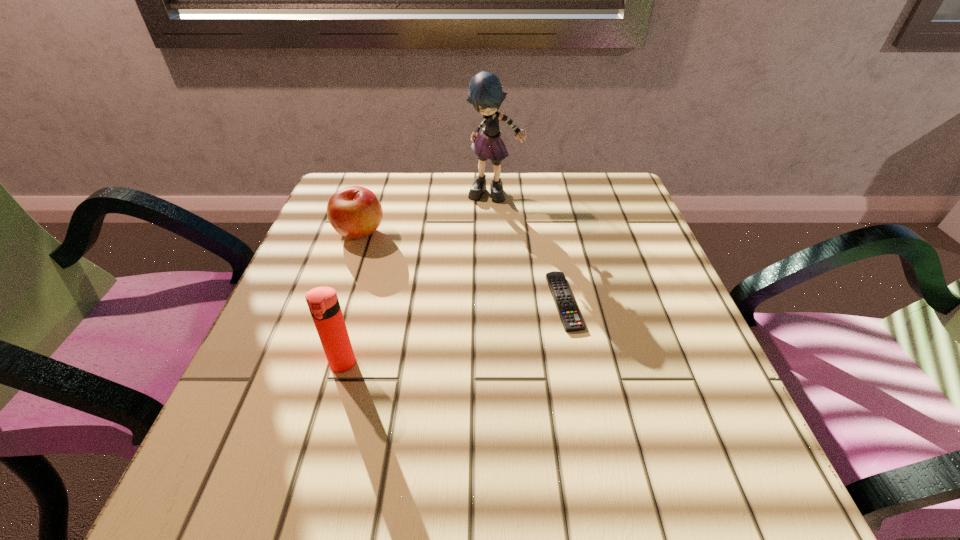
You are a GUI agent. You are given a task and a screenshot of the screen. Output one action in this format:
    pyautogui.click(x=<x>, y=<y>)
    Task: Click on the second object from right to left
    This screenshot has height=540, width=960.
    Given the screenshot: What is the action you would take?
    pyautogui.click(x=486, y=94)

Identify the location of the farthest object. The width and height of the screenshot is (960, 540). (486, 94).

Locate an element on the screen. thermos bottle is located at coordinates (323, 303).

This screenshot has height=540, width=960. I want to click on the second tallest object, so click(x=323, y=303).

At what (x,y) coordinates should I click in order to perform the action: click on the second shortest object. Please return your answer as a coordinate pair (x, y). Looking at the image, I should click on (355, 212).

This screenshot has width=960, height=540. I want to click on apple, so click(355, 212).

Locate an element on the screen. The image size is (960, 540). the rightmost object is located at coordinates (572, 321).

The width and height of the screenshot is (960, 540). Identify the location of the third farthest object. (572, 321).

The width and height of the screenshot is (960, 540). I want to click on vacant space situated on the front-facing side of the second object from right to left, so click(x=500, y=315).

Image resolution: width=960 pixels, height=540 pixels. In order to click on free location located on the back of the thermos bottle in this screenshot , I will do `click(377, 241)`.